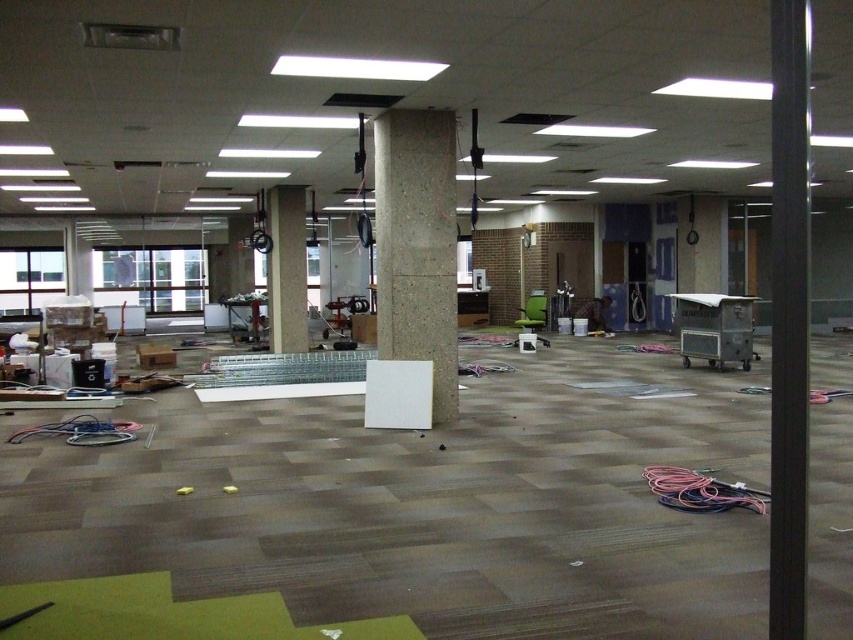
Is black smooth pole at right wider than metallic silver cart at center-right?

Yes, black smooth pole at right is wider than metallic silver cart at center-right.

Is black smooth pole at right taller than metallic silver cart at center-right?

Yes, black smooth pole at right is taller than metallic silver cart at center-right.

Measure the distance between black smooth pole at right and camera.

black smooth pole at right is 1.68 meters from camera.

Find the location of `black smooth pole at right`. black smooth pole at right is located at coordinates pos(788,316).

Who is positioned more to the left, black smooth pole at right or concrete pillar at center?

From the viewer's perspective, concrete pillar at center appears more on the left side.

The image size is (853, 640). I want to click on black smooth pole at right, so click(788, 316).

Does black smooth pole at right appear under concrete at center?

No.

Between point (799, 454) and point (450, 401), which one is positioned in front?

Point (799, 454)

What are the coordinates of `black smooth pole at right` in the screenshot? It's located at (788, 316).